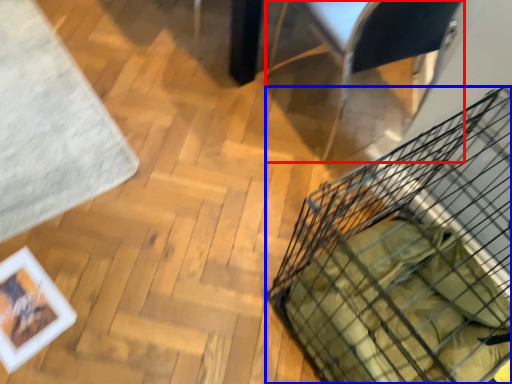
Question: Which object appears farthest to the camera in this image, armchair (highlighted by a red box) or basket (highlighted by a blue box)?

Choices:
 (A) armchair
 (B) basket

Answer: (A)